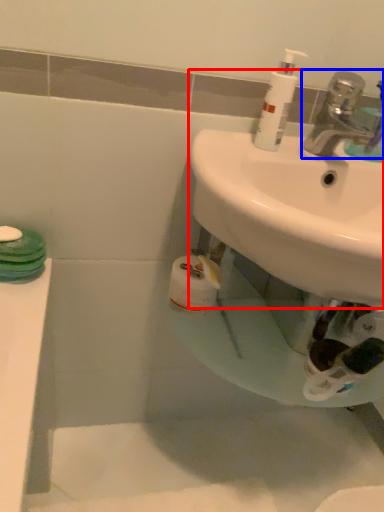
Question: Which of the following is the closest to the observer, sink (highlighted by a red box) or tap (highlighted by a blue box)?

Choices:
 (A) sink
 (B) tap

Answer: (A)